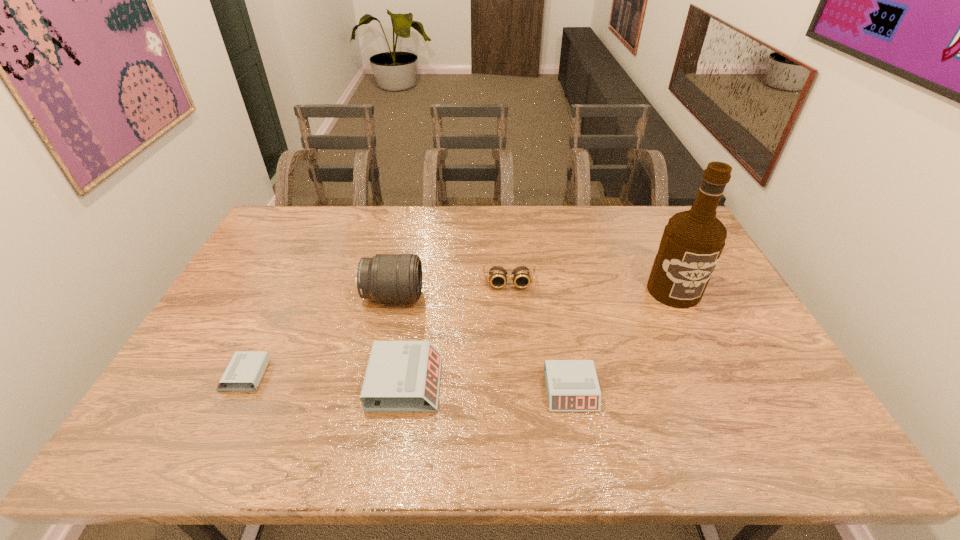
You are a GUI agent. You are given a task and a screenshot of the screen. Output one action in this format:
    pyautogui.click(x=<x>, y=<y>)
    Task: Click on the vacant area between the second tallest alarm clock and the tallest alarm clock
    The width and height of the screenshot is (960, 540).
    Given the screenshot: What is the action you would take?
    pyautogui.click(x=488, y=387)

The width and height of the screenshot is (960, 540). I want to click on vacant space that is in between the second alarm clock from left to right and the rightmost object, so point(540,336).

Where is `the closest object to the second alarm clock from left to right`? The height and width of the screenshot is (540, 960). the closest object to the second alarm clock from left to right is located at coordinates (385, 277).

Identify which object is located as the fifth nearest to the telephoto lens. Please provide its 2D coordinates. Your answer should be formatted as a tuple, i.e. [(x, y)], where the tuple contains the x and y coordinates of a point satisfying the conditions above.

[(692, 242)]

What are the coordinates of `alarm clock that is the second closest one to the rightmost object` in the screenshot? It's located at (402, 376).

Point out which alarm clock is positioned as the second nearest to the alcohol. Please provide its 2D coordinates. Your answer should be formatted as a tuple, i.e. [(x, y)], where the tuple contains the x and y coordinates of a point satisfying the conditions above.

[(402, 376)]

In order to click on free space that satisfies the following two spatial constraints: 1. on the surface of the tallest alarm clock; 2. on the left side of the fifth shortest object in this screenshot , I will do `click(373, 382)`.

Identify the location of free region that satisfies the following two spatial constraints: 1. through the lenses of the goggles; 2. on the surface of the telephoto lens. (510, 296).

Find the location of a particular element. The image size is (960, 540). free space in the image that satisfies the following two spatial constraints: 1. on the front side of the leftmost alarm clock; 2. on the left side of the rightmost alarm clock is located at coordinates (237, 390).

Identify the location of vacant space that satisfies the following two spatial constraints: 1. on the label of the tallest object; 2. on the surface of the telephoto lens. Image resolution: width=960 pixels, height=540 pixels. (677, 296).